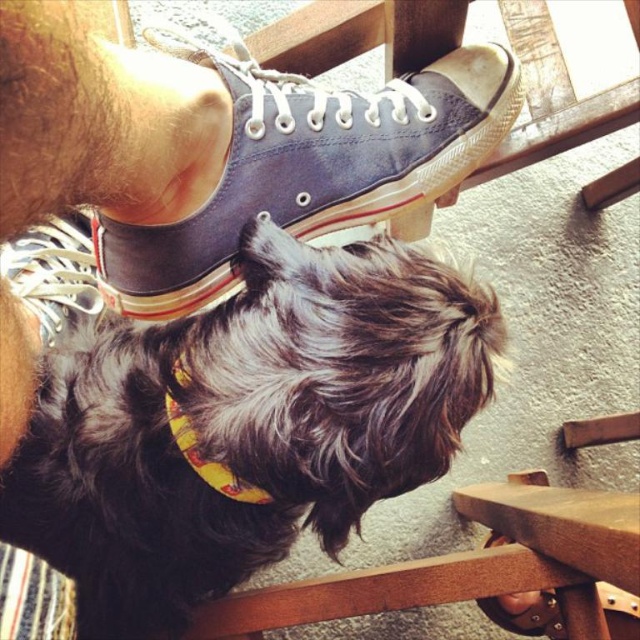
Question: Estimate the real-world distances between objects in this image. Which object is farther from the white lace-up shoe at lower left?

Choices:
 (A) yellow fabric neckband at center
 (B) blue canvas shoe at center
 (C) black fuzzy dog at lower left

Answer: (B)

Question: Estimate the real-world distances between objects in this image. Which object is farther from the white lace-up shoe at lower left?

Choices:
 (A) black fuzzy dog at lower left
 (B) blue canvas shoe at center
 (C) yellow fabric neckband at center

Answer: (B)

Question: Which is nearer to the yellow fabric neckband at center?

Choices:
 (A) white lace-up shoe at lower left
 (B) blue canvas shoe at center
 (C) black fuzzy dog at lower left

Answer: (C)

Question: Does white lace-up shoe at lower left appear on the right side of yellow fabric neckband at center?

Choices:
 (A) yes
 (B) no

Answer: (B)

Question: Is blue canvas shoe at center smaller than white lace-up shoe at lower left?

Choices:
 (A) yes
 (B) no

Answer: (B)

Question: Is black fuzzy dog at lower left above blue canvas shoe at center?

Choices:
 (A) yes
 (B) no

Answer: (B)